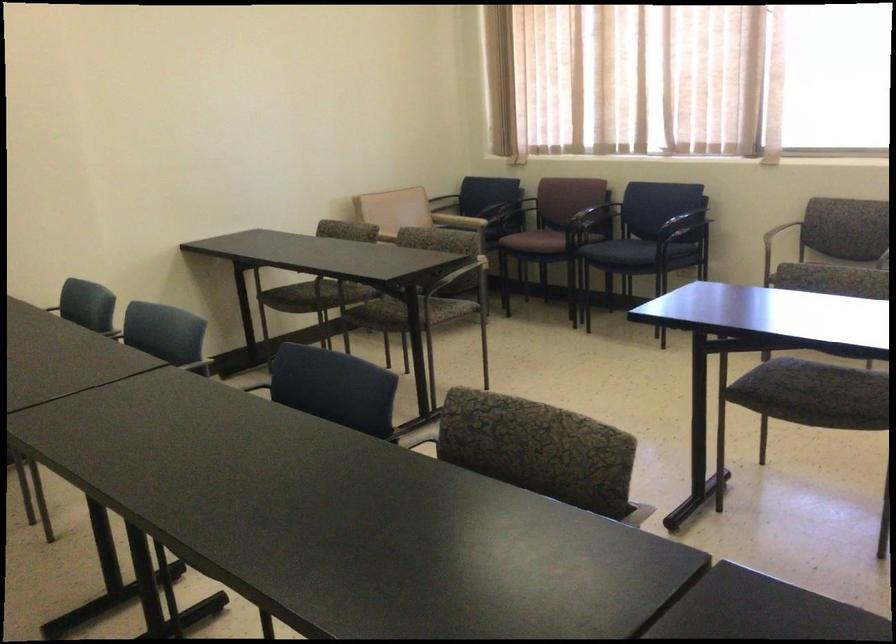
This screenshot has width=896, height=644. Identify the location of blue chair sitting surface. (627, 251).